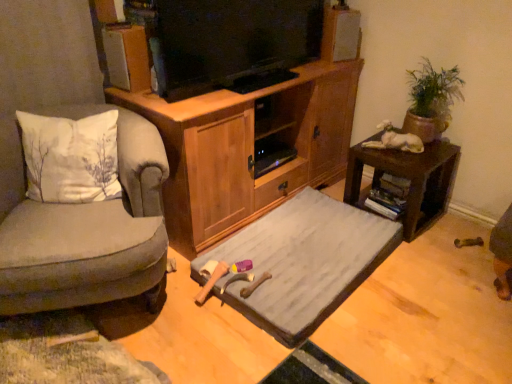
The height and width of the screenshot is (384, 512). I want to click on free space in front of green clay pot at upper right, so click(417, 158).